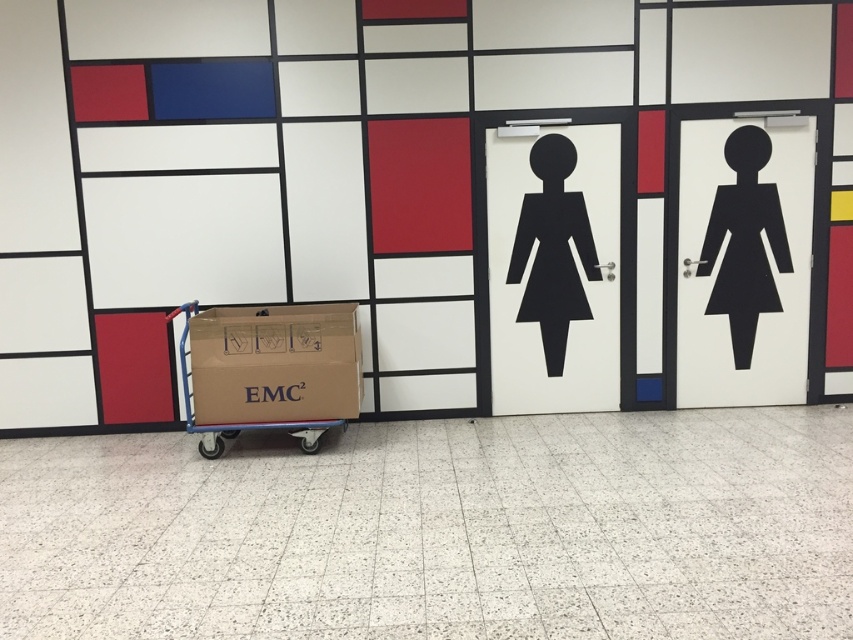
Question: Is brown cardboard trolley at center to the right of black matte figure at center from the viewer's perspective?

Choices:
 (A) yes
 (B) no

Answer: (B)

Question: Which point is closer to the camera?

Choices:
 (A) (520, 262)
 (B) (746, 147)

Answer: (B)

Question: Based on their relative distances, which object is farther from the black matte sign at right?

Choices:
 (A) black matte figure at center
 (B) brown cardboard trolley at center

Answer: (B)

Question: Does black matte sign at right have a smaller size compared to black matte figure at center?

Choices:
 (A) yes
 (B) no

Answer: (B)

Question: Which of the following is the farthest from the observer?

Choices:
 (A) brown cardboard trolley at center
 (B) black matte figure at center
 (C) black matte sign at right

Answer: (C)

Question: From the image, what is the correct spatial relationship of brown cardboard trolley at center in relation to black matte figure at center?

Choices:
 (A) below
 (B) above

Answer: (A)